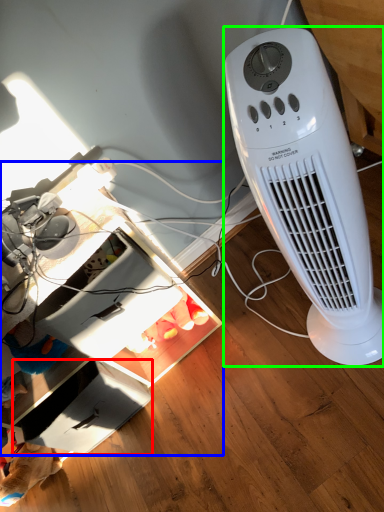
Question: Considering the real-world distances, which object is closest to drawer (highlighted by a red box)? computer desk (highlighted by a blue box) or home appliance (highlighted by a green box).

Choices:
 (A) computer desk
 (B) home appliance

Answer: (A)